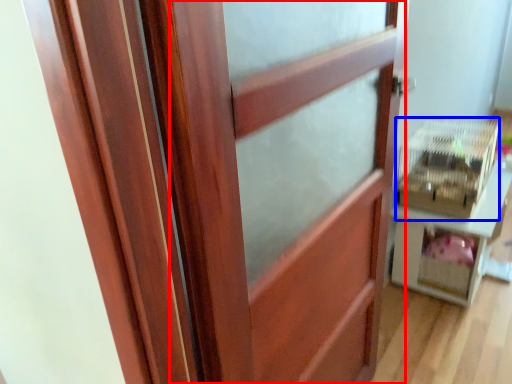
Question: Which object appears closest to the camera in this image, barn door (highlighted by a red box) or crate (highlighted by a blue box)?

Choices:
 (A) barn door
 (B) crate

Answer: (A)